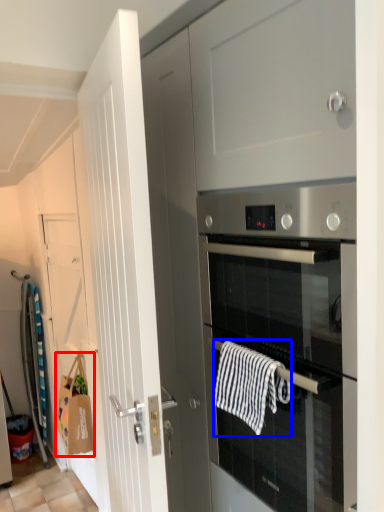
Question: Which object appears closest to the camera in this image, hand towel (highlighted by a red box) or hand towel (highlighted by a blue box)?

Choices:
 (A) hand towel
 (B) hand towel

Answer: (B)